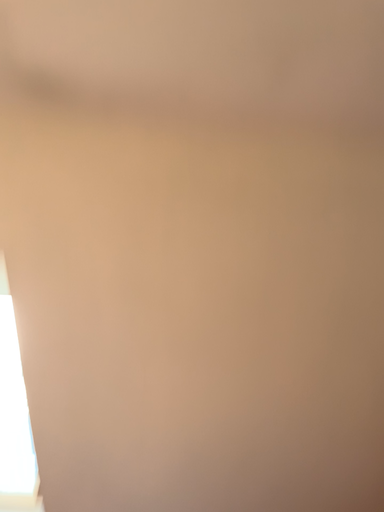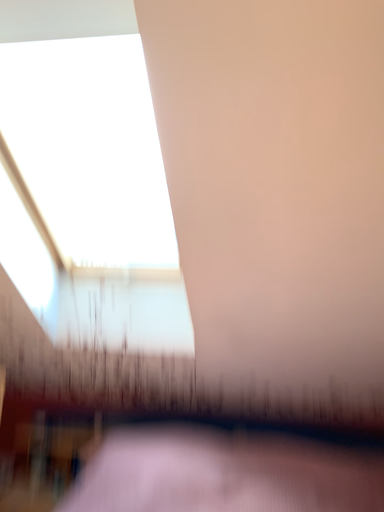
Question: Which way did the camera rotate in the video?

Choices:
 (A) rotated left
 (B) rotated right

Answer: (A)